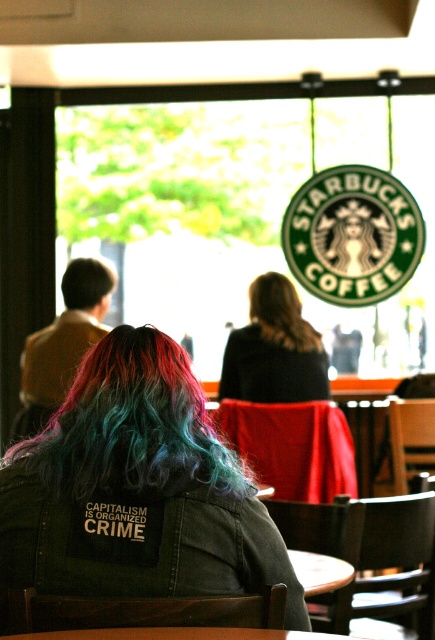
Question: Which of the following is the closest to the observer?

Choices:
 (A) (94, 420)
 (B) (174, 627)

Answer: (B)

Question: Can you confirm if denim jacket at center is wider than dark brown hair at center?

Choices:
 (A) yes
 (B) no

Answer: (A)

Question: Does denim jacket at center come behind wooden table at center?

Choices:
 (A) no
 (B) yes

Answer: (B)

Question: Among these points, which one is farthest from the camera?

Choices:
 (A) (74, 259)
 (B) (301, 320)

Answer: (A)

Question: Where is dark brown hair at center located in relation to brown matte hair at upper left in the image?

Choices:
 (A) left
 (B) right

Answer: (B)

Question: Which point is farther from the camera taking this photo?

Choices:
 (A) (284, 292)
 (B) (70, 273)

Answer: (A)